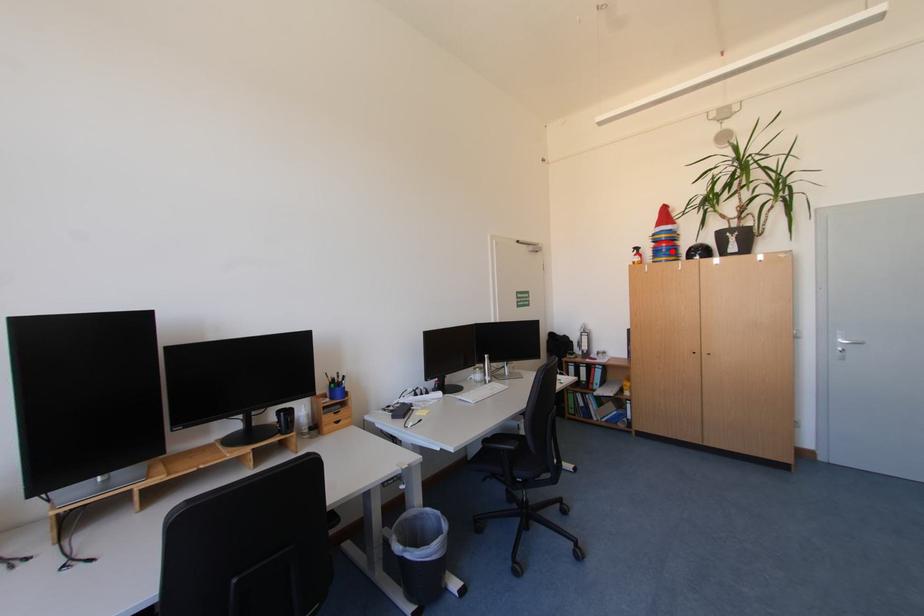
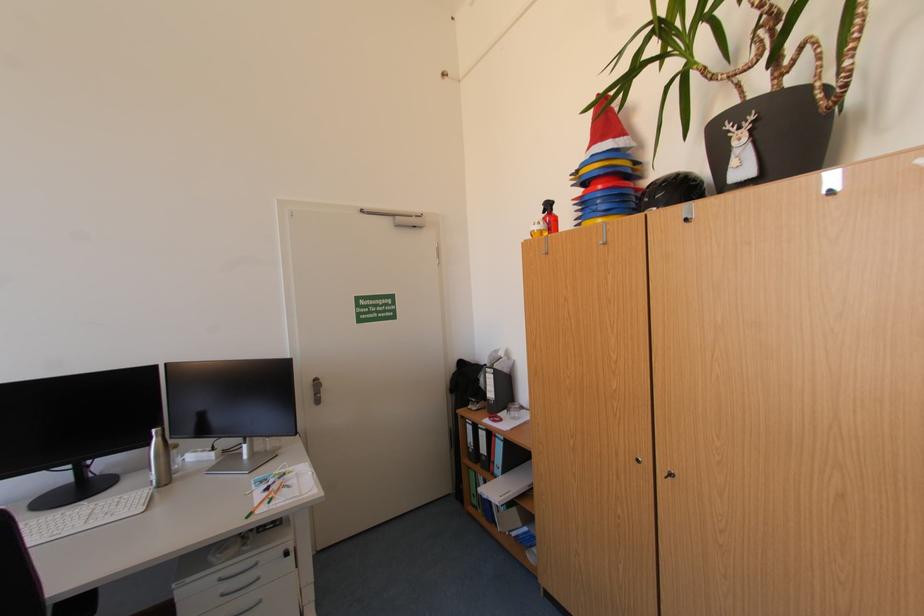
The point at the highlighted location is marked in the first image. Where is the corresponding point in the second image?

(606, 203)